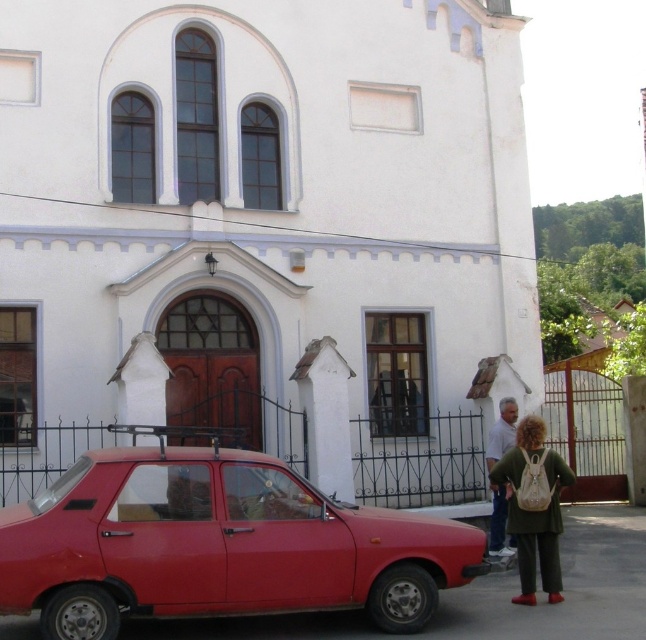
Is green fabric backpack at lower right positioned behind green fabric jacket at lower right?

No, green fabric backpack at lower right is in front of green fabric jacket at lower right.

Locate an element on the screen. The width and height of the screenshot is (646, 640). green fabric backpack at lower right is located at coordinates (534, 506).

Between point (528, 536) and point (492, 552), which one is positioned behind?

The point (492, 552) is behind.

Where is `green fabric backpack at lower right`? green fabric backpack at lower right is located at coordinates (534, 506).

Is white smooth church at center below green fabric backpack at lower right?

No, white smooth church at center is not below green fabric backpack at lower right.

Between point (401, 168) and point (505, 458), which one is positioned behind?

The point (401, 168) is behind.

I want to click on white smooth church at center, so click(264, 200).

Is glossy red car at lower left positioned in front of green fabric backpack at lower right?

Yes, glossy red car at lower left is closer to the viewer.

Describe the element at coordinates (216, 545) in the screenshot. The image size is (646, 640). I see `glossy red car at lower left` at that location.

Measure the distance between glossy red car at lower left and camera.

24.62 feet

Identify the location of glossy red car at lower left. (216, 545).